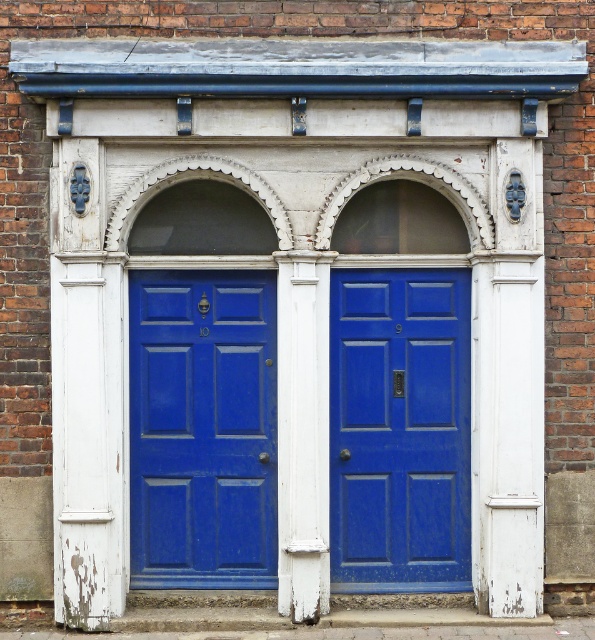
You are a delivery person carrying a box that is 15 inches wide. You need to pass between the matte blue door at left and the white painted wood pillar at center. Can your box fit through the space without tilting it sideways?

The distance between the matte blue door at left and the white painted wood pillar at center is 14.74 inches. Since the box is 15 inches wide, it cannot fit through the space without tilting it sideways.

You are standing in front of the doors and want to find the matte blue door at left. According to the coordinates provided, where would you look relative to the other door?

The matte blue door at left is located at coordinates point (202, 428), which places it to the left side of the structure relative to the other door.

You are standing in front of two symmetrical blue doors. The coordinates of the left door are given as point (202, 428). If you want to open the right door, which coordinate would you target?

The right door would be at the coordinate point mirrored from the left door. Since the left door is at point (202, 428), the right door would be at point 0.329, 0.341.